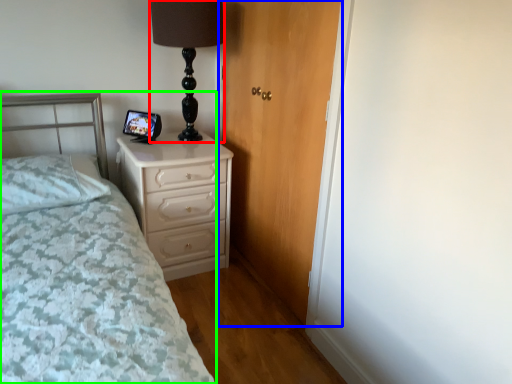
Question: Based on their relative distances, which object is farther from table lamp (highlighted by a red box)? Choose from door (highlighted by a blue box) and bed (highlighted by a green box).

Choices:
 (A) door
 (B) bed

Answer: (B)